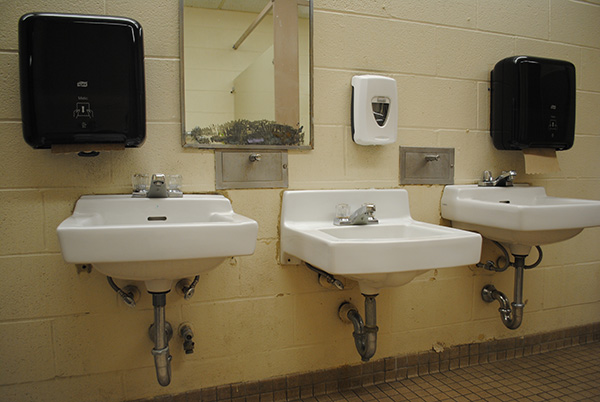
At what (x,y) coordinates should I click in order to perform the action: click on silver colored faucet. Please return your answer as a coordinate pair (x, y). This screenshot has width=600, height=402. Looking at the image, I should click on (364, 210).